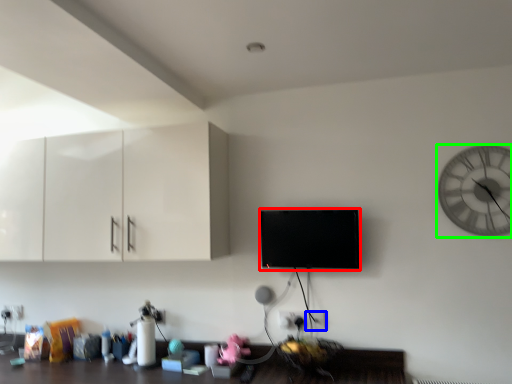
Question: Based on their relative distances, which object is farther from flat (highlighted by a red box)? Choose from electric outlet (highlighted by a blue box) and wall clock (highlighted by a green box).

Choices:
 (A) electric outlet
 (B) wall clock

Answer: (B)